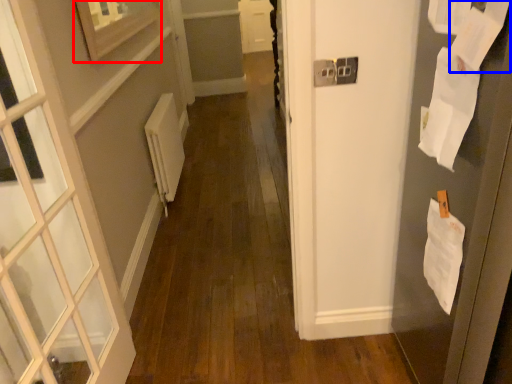
Question: Which of the following is the farthest to the observer, picture frame (highlighted by a red box) or paper (highlighted by a blue box)?

Choices:
 (A) picture frame
 (B) paper

Answer: (A)